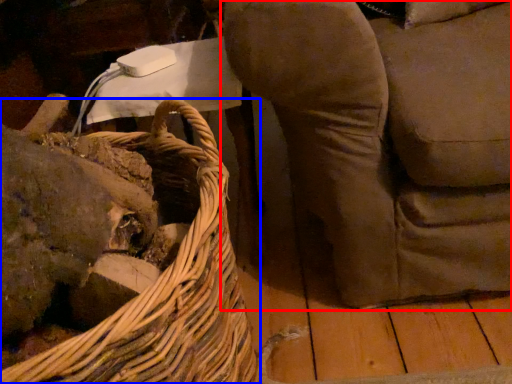
Question: Which object appears farthest to the camera in this image, furniture (highlighted by a red box) or picnic basket (highlighted by a blue box)?

Choices:
 (A) furniture
 (B) picnic basket

Answer: (A)